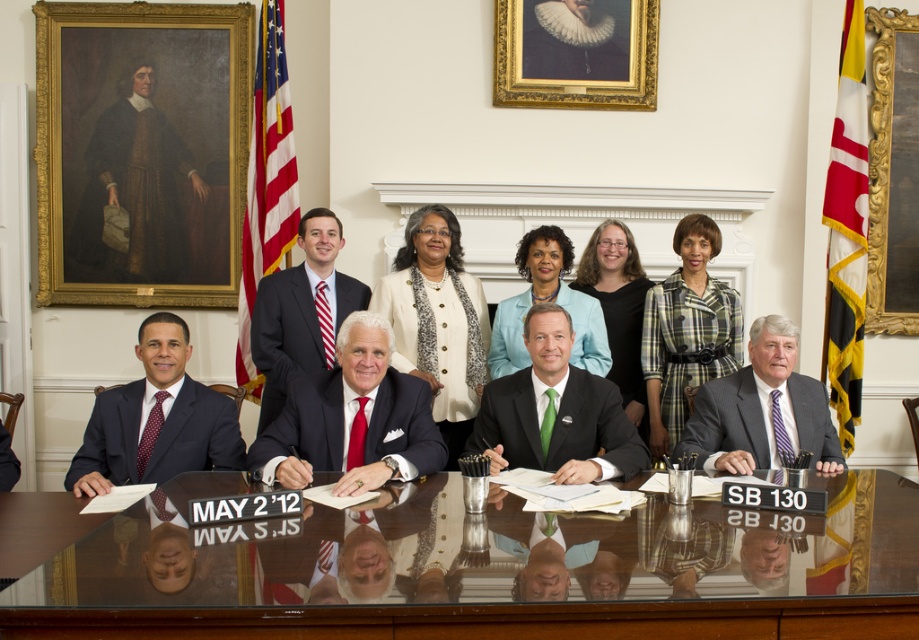
Between matte black suit at left and striped tie at center, which one appears on the right side from the viewer's perspective?

From the viewer's perspective, striped tie at center appears more on the right side.

Can you confirm if matte black suit at left is smaller than striped tie at center?

Yes.

I want to click on matte black suit at left, so click(156, 420).

Image resolution: width=919 pixels, height=640 pixels. In order to click on green silk tie at center in this screenshot , I will do click(x=554, y=412).

Does green silk tie at center have a greater height compared to shiny dark suit at center?

No, green silk tie at center is not taller than shiny dark suit at center.

Locate an element on the screen. The height and width of the screenshot is (640, 919). green silk tie at center is located at coordinates (554, 412).

Between striped tie at center and shiny dark suit at center, which one has more height?

shiny dark suit at center is taller.

Is striped tie at center to the left of shiny dark suit at center from the viewer's perspective?

No, striped tie at center is not to the left of shiny dark suit at center.

Does point (798, 388) come behind point (278, 320)?

No, it is not.

The height and width of the screenshot is (640, 919). What are the coordinates of `striped tie at center` in the screenshot? It's located at (762, 408).